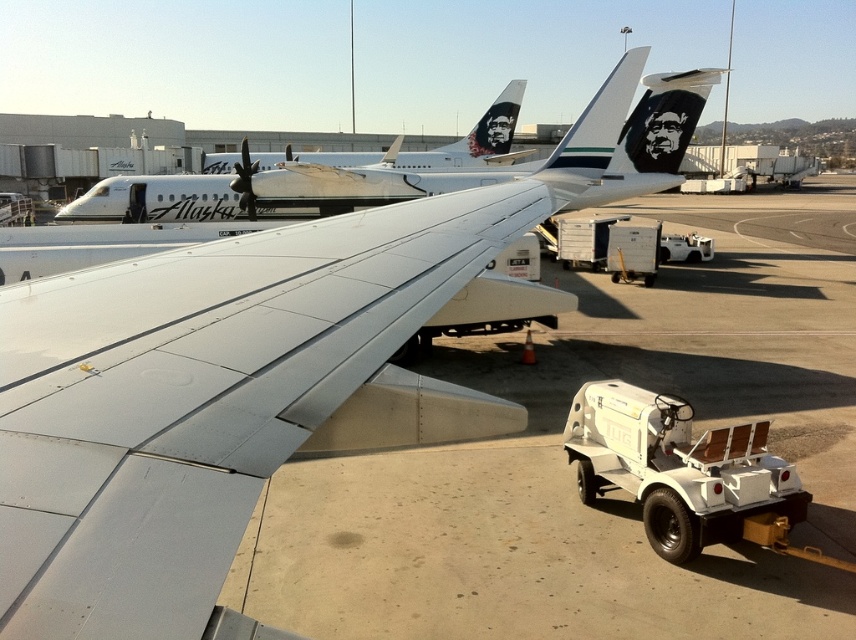
Question: Which object appears farthest from the camera in this image?

Choices:
 (A) white glossy airplane at upper left
 (B) white matte tarmac at center
 (C) white glossy airplane at upper center
 (D) metallic gray wing at center

Answer: (C)

Question: Does metallic gray wing at center appear under white glossy airplane at upper center?

Choices:
 (A) no
 (B) yes

Answer: (B)

Question: Can you confirm if white glossy airplane at upper left is positioned above white glossy airplane at upper center?

Choices:
 (A) no
 (B) yes

Answer: (A)

Question: Which point is closer to the camera?

Choices:
 (A) (86, 209)
 (B) (366, 160)
 (C) (242, 563)
 (D) (251, 481)

Answer: (D)

Question: From the image, what is the correct spatial relationship of white matte tarmac at center in relation to metallic gray wing at center?

Choices:
 (A) left
 (B) right

Answer: (B)

Question: Which of the following is the farthest from the observer?

Choices:
 (A) white glossy airplane at upper left
 (B) white glossy airplane at upper center
 (C) metallic gray wing at center
 (D) white matte tarmac at center

Answer: (B)